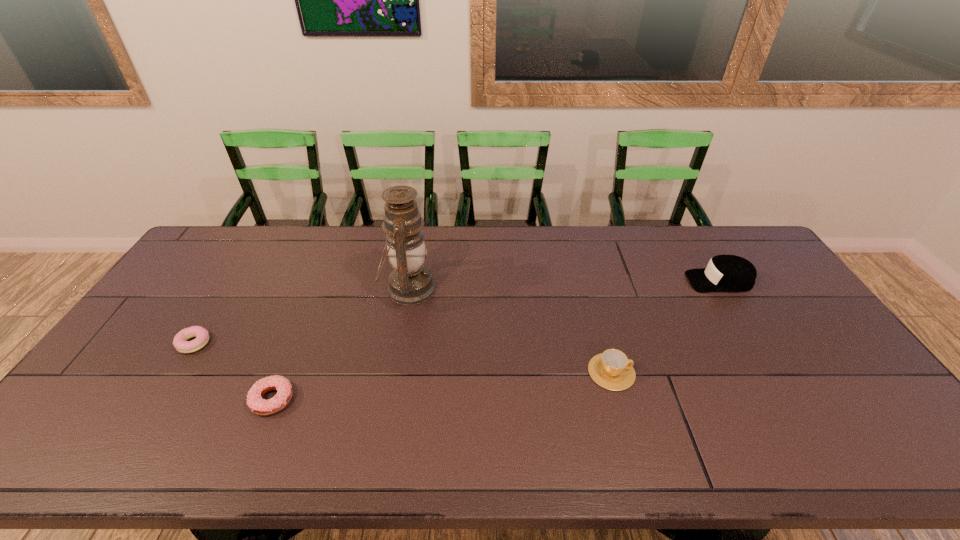
Where is `free space between the second tallest object and the leftmost object`? The image size is (960, 540). free space between the second tallest object and the leftmost object is located at coordinates pos(457,312).

This screenshot has width=960, height=540. What are the coordinates of `vacant space that is in between the second tallest object and the tallest object` in the screenshot? It's located at (564, 285).

Locate an element on the screen. free space between the oil lamp and the nearer doughnut is located at coordinates (341, 344).

The width and height of the screenshot is (960, 540). Identify the location of empty space between the leftmost object and the right doughnut. (233, 372).

I want to click on empty location between the leftmost object and the fourth object from left to right, so click(403, 357).

Identify which object is the second nearest to the farther doughnut. Please provide its 2D coordinates. Your answer should be formatted as a tuple, i.e. [(x, y)], where the tuple contains the x and y coordinates of a point satisfying the conditions above.

[(410, 282)]

The height and width of the screenshot is (540, 960). I want to click on object that stands as the third closest to the rightmost object, so click(x=259, y=406).

The height and width of the screenshot is (540, 960). What are the coordinates of `free space that satisfies the following two spatial constraints: 1. on the front-facing side of the second tallest object; 2. on the front side of the nearer doughnut` in the screenshot? It's located at (792, 400).

You are a GUI agent. You are given a task and a screenshot of the screen. Output one action in this format:
    pyautogui.click(x=<x>, y=<y>)
    Task: Click on the free spot that satisfies the following two spatial constraints: 1. on the back side of the third object from right to left; 2. on the left side of the leftmost object
    
    Given the screenshot: What is the action you would take?
    pyautogui.click(x=228, y=289)

Where is `free location that satisfies the following two spatial constraints: 1. on the front-facing side of the fourth shortest object; 2. on the front side of the second object from left to right`? free location that satisfies the following two spatial constraints: 1. on the front-facing side of the fourth shortest object; 2. on the front side of the second object from left to right is located at coordinates (792, 400).